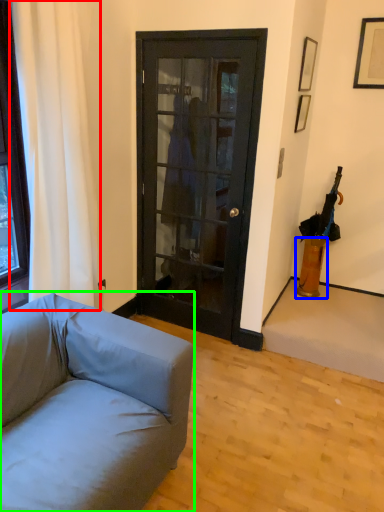
Question: Which is farther away from curtain (highlighted by a red box)? vase (highlighted by a blue box) or studio couch (highlighted by a green box)?

Choices:
 (A) vase
 (B) studio couch

Answer: (A)